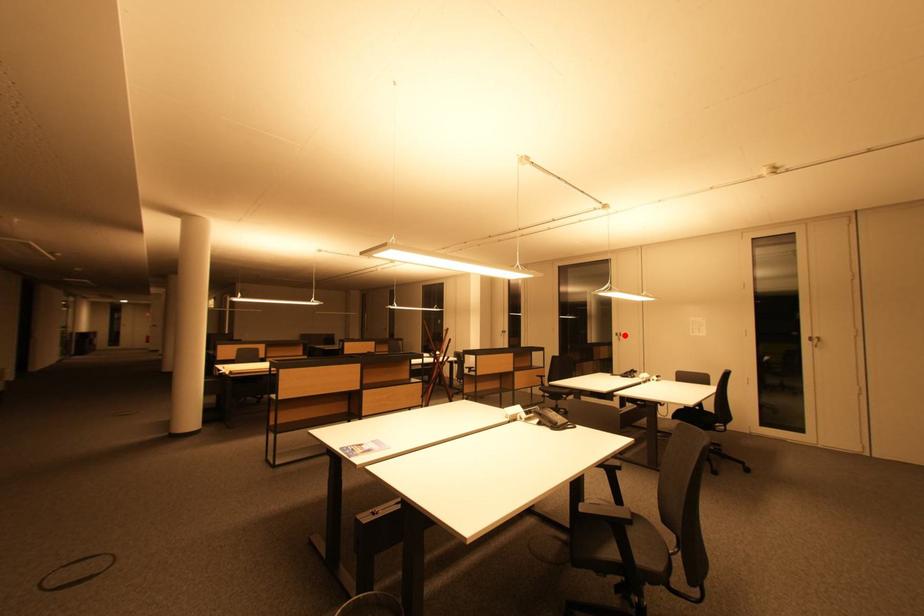
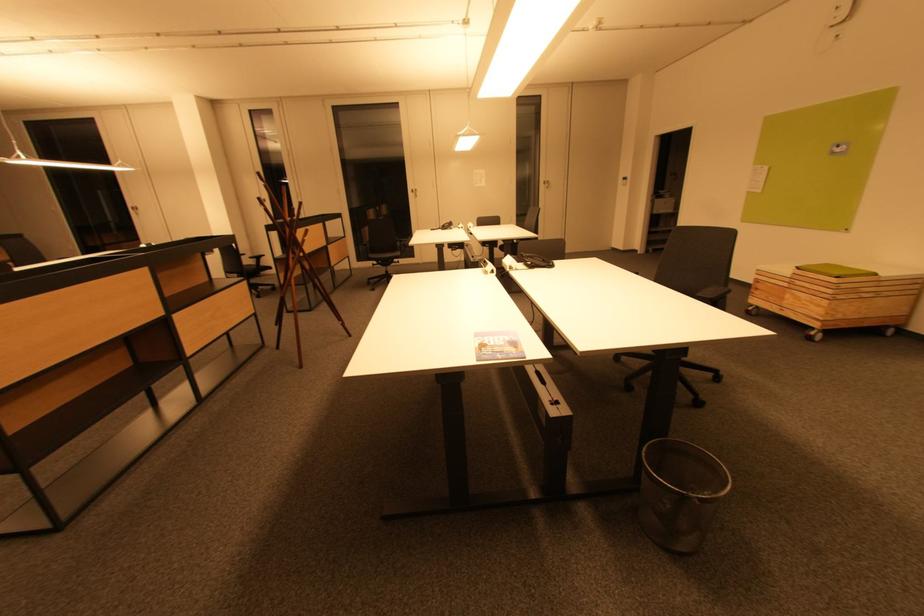
Question: A red point is marked in image1. In image2, is the corresponding 3D point closer to the camera or farther? Reply with the corresponding letter.

Choices:
 (A) The corresponding 3D point is closer.
 (B) The corresponding 3D point is farther.

Answer: (A)